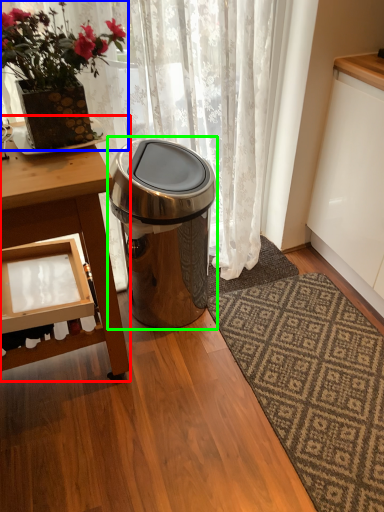
Question: Which object is the closest to the table (highlighted by a red box)? Choose among these: houseplant (highlighted by a blue box) or trash bin/can (highlighted by a green box).

Choices:
 (A) houseplant
 (B) trash bin/can

Answer: (A)